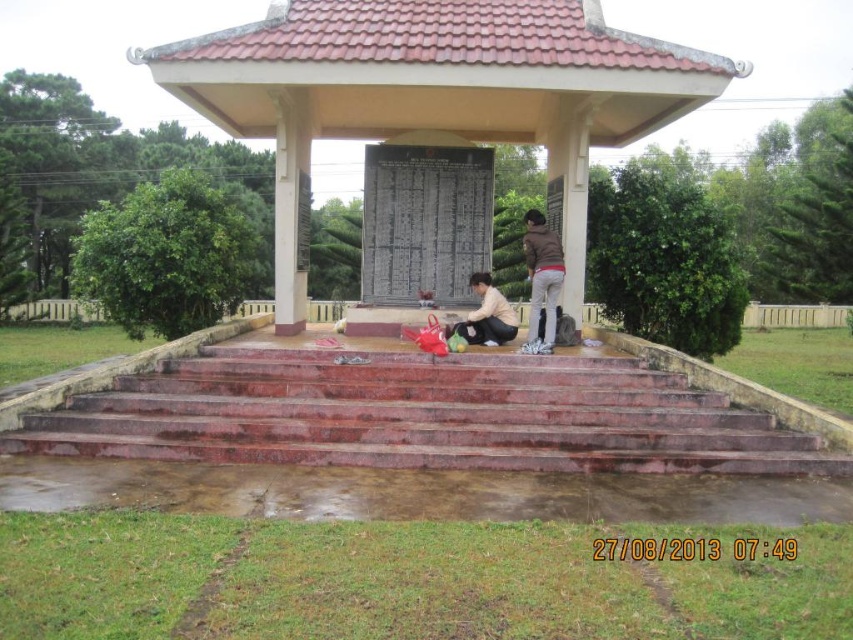
Question: Does smooth concrete gazebo at center lie behind marble stairs at center?

Choices:
 (A) no
 (B) yes

Answer: (B)

Question: Which of these objects is positioned farthest from the smooth concrete gazebo at center?

Choices:
 (A) matte black bag at center
 (B) marble stairs at center

Answer: (B)

Question: Can you confirm if smooth concrete gazebo at center is bigger than matte black bag at center?

Choices:
 (A) no
 (B) yes

Answer: (B)

Question: Which object is closer to the camera taking this photo?

Choices:
 (A) smooth concrete gazebo at center
 (B) brown leather jacket at center
 (C) matte black bag at center

Answer: (A)

Question: Can you confirm if smooth concrete gazebo at center is positioned to the left of brown leather jacket at center?

Choices:
 (A) no
 (B) yes

Answer: (B)

Question: Which point appears farthest from the camera in this image?

Choices:
 (A) pyautogui.click(x=561, y=108)
 (B) pyautogui.click(x=534, y=241)
 (C) pyautogui.click(x=512, y=337)

Answer: (A)